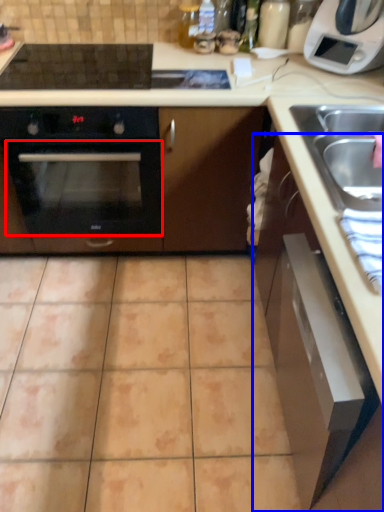
Question: Which of the following is the closest to the observer, oven (highlighted by a red box) or cabinetry (highlighted by a blue box)?

Choices:
 (A) oven
 (B) cabinetry

Answer: (B)